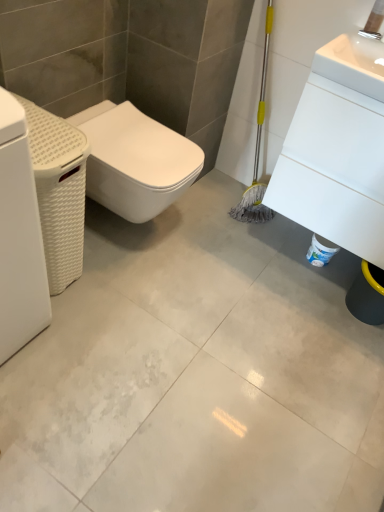
Image resolution: width=384 pixels, height=512 pixels. Describe the element at coordinates (59, 191) in the screenshot. I see `white woven basket at left, placed as the 2th porcelain when sorted from right to left` at that location.

Measure the distance between white woven basket at left, placed as the 2th porcelain when sorted from right to left, and camera.

They are 3.52 feet apart.

The height and width of the screenshot is (512, 384). Find the location of `white matte bidet at left`. white matte bidet at left is located at coordinates (137, 163).

Locate an element on the screen. The height and width of the screenshot is (512, 384). white woven basket at left, placed as the 2th porcelain when sorted from right to left is located at coordinates (59, 191).

Is white woven basket at left, placed as the 2th porcelain when sorted from right to left, shorter than white matte washing machine at left?

Indeed, white woven basket at left, placed as the 2th porcelain when sorted from right to left, has a lesser height compared to white matte washing machine at left.

Is white woven basket at left, the first porcelain viewed from the left, wider than white matte washing machine at left?

Yes, white woven basket at left, the first porcelain viewed from the left, is wider than white matte washing machine at left.

Is white woven basket at left, placed as the 2th porcelain when sorted from right to left, looking in the opposite direction of white matte washing machine at left?

No, white woven basket at left, placed as the 2th porcelain when sorted from right to left, is not facing the opposite direction of white matte washing machine at left.

Is white matte bidet at left aimed at white glossy concrete at center?

No, white matte bidet at left is not oriented towards white glossy concrete at center.

Which of these two, white matte bidet at left or white glossy concrete at center, is wider?

With larger width is white glossy concrete at center.

Considering the relative sizes of white matte bidet at left and white glossy concrete at center in the image provided, is white matte bidet at left shorter than white glossy concrete at center?

In fact, white matte bidet at left may be taller than white glossy concrete at center.

The width and height of the screenshot is (384, 512). I want to click on concrete below the white matte bidet at left (from a real-world perspective), so click(197, 373).

Is white matte washing machine at left facing towards white woven basket at left, the first porcelain viewed from the left?

No.

Considering the sizes of objects white matte washing machine at left and white woven basket at left, the first porcelain viewed from the left, in the image provided, who is taller, white matte washing machine at left or white woven basket at left, the first porcelain viewed from the left,?

Standing taller between the two is white matte washing machine at left.

Which is more to the left, white matte washing machine at left or white woven basket at left, placed as the 2th porcelain when sorted from right to left?

Positioned to the left is white matte washing machine at left.

From a real-world perspective, is white matte washing machine at left on white woven basket at left, placed as the 2th porcelain when sorted from right to left?

Yes, from a real-world perspective, white matte washing machine at left is on top of white woven basket at left, placed as the 2th porcelain when sorted from right to left.

Does white matte washing machine at left lie in front of white matte bidet at left?

Yes, white matte washing machine at left is closer to the camera.

Is point (25, 298) closer or farther from the camera than point (187, 140)?

Point (25, 298) is closer to the camera than point (187, 140).

In the scene shown: Between white matte washing machine at left and white matte bidet at left, which one has smaller width?

white matte washing machine at left.

Between white glossy sink at upper right, placed as the first porcelain when sorted from right to left, and white matte bidet at left, which one has more height?

With more height is white glossy sink at upper right, placed as the first porcelain when sorted from right to left.

Considering the positions of points (290, 154) and (123, 205), is point (290, 154) closer to camera compared to point (123, 205)?

That is True.

From a real-world perspective, is white glossy sink at upper right, placed as the first porcelain when sorted from right to left, below white matte bidet at left?

Actually, white glossy sink at upper right, placed as the first porcelain when sorted from right to left, is physically above white matte bidet at left in the real world.

Locate an element on the screen. The height and width of the screenshot is (512, 384). bidet to the left of white glossy sink at upper right, placed as the first porcelain when sorted from right to left is located at coordinates (137, 163).

From the image's perspective, is white glossy concrete at center positioned above or below white glossy sink at upper right, the 2th porcelain positioned from the left?

Based on their image positions, white glossy concrete at center is located beneath white glossy sink at upper right, the 2th porcelain positioned from the left.

Is the surface of white glossy concrete at center in direct contact with white glossy sink at upper right, the 2th porcelain positioned from the left?

No, white glossy concrete at center is not making contact with white glossy sink at upper right, the 2th porcelain positioned from the left.

Considering the positions of objects white glossy concrete at center and white glossy sink at upper right, the 2th porcelain positioned from the left, in the image provided, who is more to the right, white glossy concrete at center or white glossy sink at upper right, the 2th porcelain positioned from the left,?

From the viewer's perspective, white glossy sink at upper right, the 2th porcelain positioned from the left, appears more on the right side.

Is white glossy sink at upper right, placed as the first porcelain when sorted from right to left, surrounding white glossy concrete at center?

No, white glossy sink at upper right, placed as the first porcelain when sorted from right to left, does not contain white glossy concrete at center.

Can you confirm if white glossy sink at upper right, placed as the first porcelain when sorted from right to left, is positioned to the left of white glossy concrete at center?

No.

Can you confirm if white glossy sink at upper right, placed as the first porcelain when sorted from right to left, is thinner than white glossy concrete at center?

Correct, the width of white glossy sink at upper right, placed as the first porcelain when sorted from right to left, is less than that of white glossy concrete at center.

Is there a large distance between white glossy sink at upper right, the 2th porcelain positioned from the left, and white glossy concrete at center?

No.

Identify the location of the 1st porcelain counting from the right of the white matte washing machine at left. The height and width of the screenshot is (512, 384). (59, 191).

Where is `bidet to the left of white glossy concrete at center`? bidet to the left of white glossy concrete at center is located at coordinates (137, 163).

Consider the image. Considering their positions, is white glossy concrete at center positioned further to white matte washing machine at left than white matte bidet at left?

white glossy concrete at center is further to white matte washing machine at left.

Based on their spatial positions, is white glossy sink at upper right, the 2th porcelain positioned from the left, or white glossy concrete at center closer to white woven basket at left, placed as the 2th porcelain when sorted from right to left?

white glossy concrete at center lies closer to white woven basket at left, placed as the 2th porcelain when sorted from right to left, than the other object.

Looking at the image, which one is located further to white woven basket at left, placed as the 2th porcelain when sorted from right to left, white matte washing machine at left or white glossy sink at upper right, the 2th porcelain positioned from the left?

Among the two, white glossy sink at upper right, the 2th porcelain positioned from the left, is located further to white woven basket at left, placed as the 2th porcelain when sorted from right to left.

Based on the photo, when comparing their distances from white woven basket at left, placed as the 2th porcelain when sorted from right to left, does white glossy sink at upper right, placed as the first porcelain when sorted from right to left, or white matte washing machine at left seem closer?

white matte washing machine at left is closer to white woven basket at left, placed as the 2th porcelain when sorted from right to left.

Considering their positions, is white matte washing machine at left positioned further to white glossy concrete at center than white matte bidet at left?

white matte washing machine at left lies further to white glossy concrete at center than the other object.

Which object lies further to the anchor point white matte washing machine at left, white woven basket at left, the first porcelain viewed from the left, or white matte bidet at left?

white matte bidet at left is positioned further to the anchor white matte washing machine at left.

Estimate the real-world distances between objects in this image. Which object is further from white woven basket at left, placed as the 2th porcelain when sorted from right to left, white matte bidet at left or white glossy sink at upper right, the 2th porcelain positioned from the left?

white glossy sink at upper right, the 2th porcelain positioned from the left.

Considering their positions, is white matte bidet at left positioned closer to white matte washing machine at left than white glossy sink at upper right, placed as the first porcelain when sorted from right to left?

Among the two, white matte bidet at left is located nearer to white matte washing machine at left.

Where is `concrete between white woven basket at left, placed as the 2th porcelain when sorted from right to left, and white glossy sink at upper right, the 2th porcelain positioned from the left, in the horizontal direction`? concrete between white woven basket at left, placed as the 2th porcelain when sorted from right to left, and white glossy sink at upper right, the 2th porcelain positioned from the left, in the horizontal direction is located at coordinates (197, 373).

Identify the location of bidet between white matte washing machine at left and white glossy sink at upper right, the 2th porcelain positioned from the left, from left to right. (137, 163).

Locate an element on the screen. The width and height of the screenshot is (384, 512). concrete located between white matte bidet at left and white glossy sink at upper right, placed as the first porcelain when sorted from right to left, in the left-right direction is located at coordinates (197, 373).

Image resolution: width=384 pixels, height=512 pixels. I want to click on porcelain between white matte washing machine at left and white glossy concrete at center in the horizontal direction, so click(59, 191).